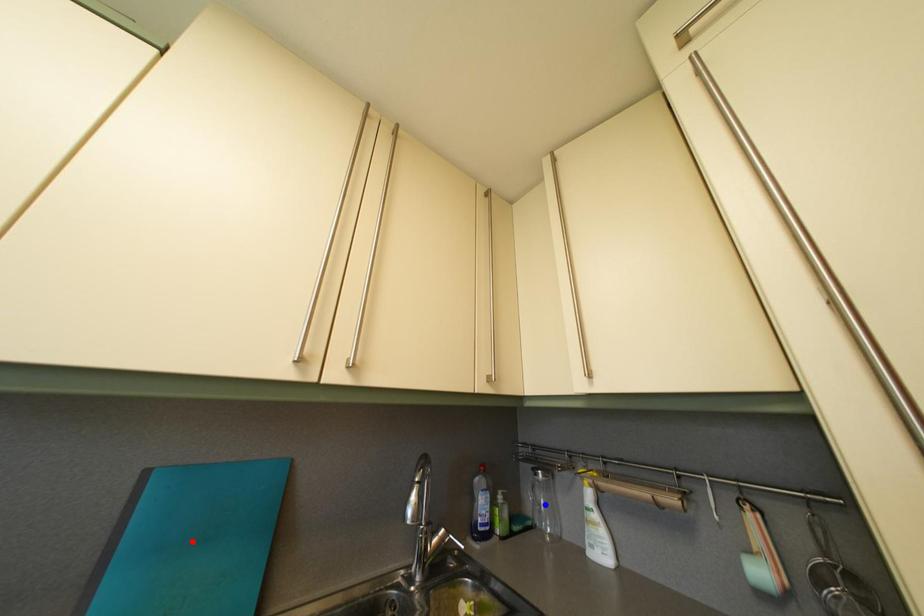
Question: Two points are marked on the image. Which point is closer to the camera?

Choices:
 (A) Blue point is closer.
 (B) Red point is closer.

Answer: (B)